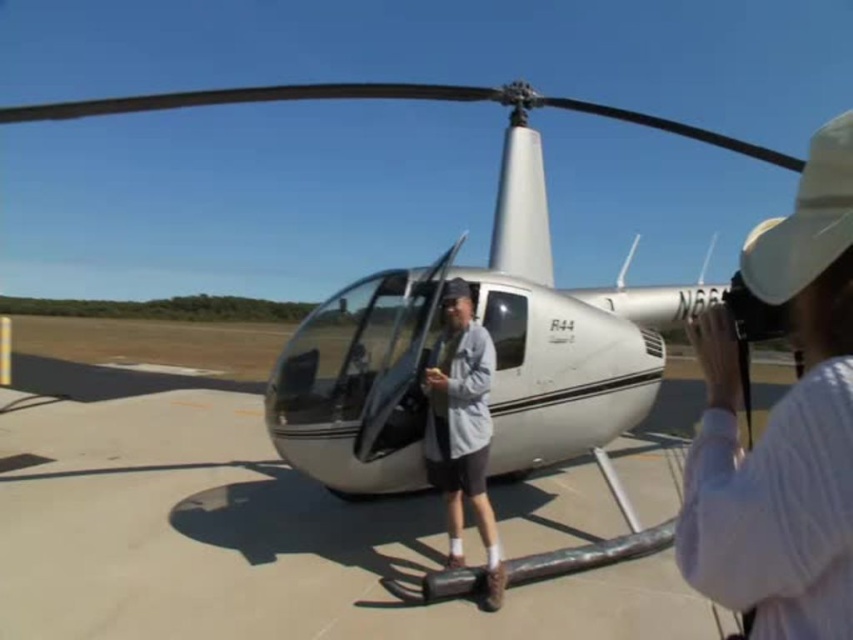
Who is lower down, white cotton hat at upper right or white glossy helicopter at center?

Positioned lower is white cotton hat at upper right.

Is point (779, 225) in front of point (413, 472)?

Yes, it is.

Which is in front, point (817, 212) or point (328, 348)?

Positioned in front is point (817, 212).

The height and width of the screenshot is (640, 853). In order to click on white cotton hat at upper right in this screenshot , I will do pyautogui.click(x=782, y=426).

Does smooth concrete tarmac at center appear over white glossy helicopter at center?

No, smooth concrete tarmac at center is not above white glossy helicopter at center.

Measure the distance between smooth concrete tarmac at center and camera.

smooth concrete tarmac at center and camera are 35.79 inches apart from each other.

Is point (355, 600) closer to camera compared to point (299, 92)?

Yes, it is in front of point (299, 92).

Locate an element on the screen. Image resolution: width=853 pixels, height=640 pixels. smooth concrete tarmac at center is located at coordinates (241, 532).

Is smooth concrete tarmac at center to the right of white cotton hat at upper right from the viewer's perspective?

In fact, smooth concrete tarmac at center is to the left of white cotton hat at upper right.

Which of these two, smooth concrete tarmac at center or white cotton hat at upper right, stands taller?

smooth concrete tarmac at center

Locate an element on the screen. This screenshot has width=853, height=640. smooth concrete tarmac at center is located at coordinates pos(241,532).

Find the location of a particular element. smooth concrete tarmac at center is located at coordinates (241, 532).